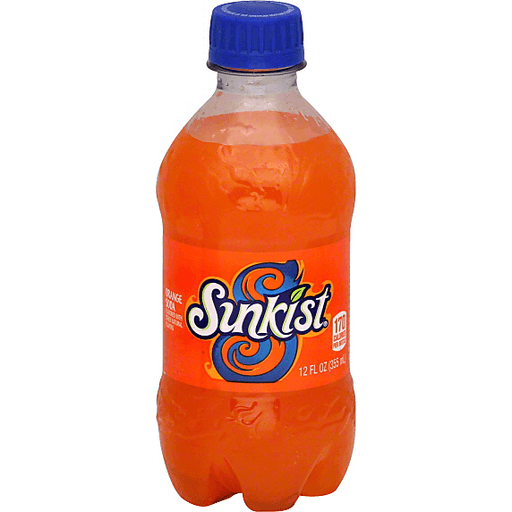
Identify the location of bottle. (230, 157), (267, 432).